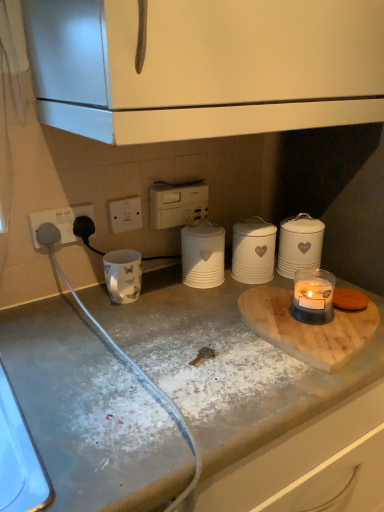
Locate an element on the screen. This screenshot has width=384, height=512. blank space situated above wooden cutting board at center (from a real-world perspective) is located at coordinates (305, 321).